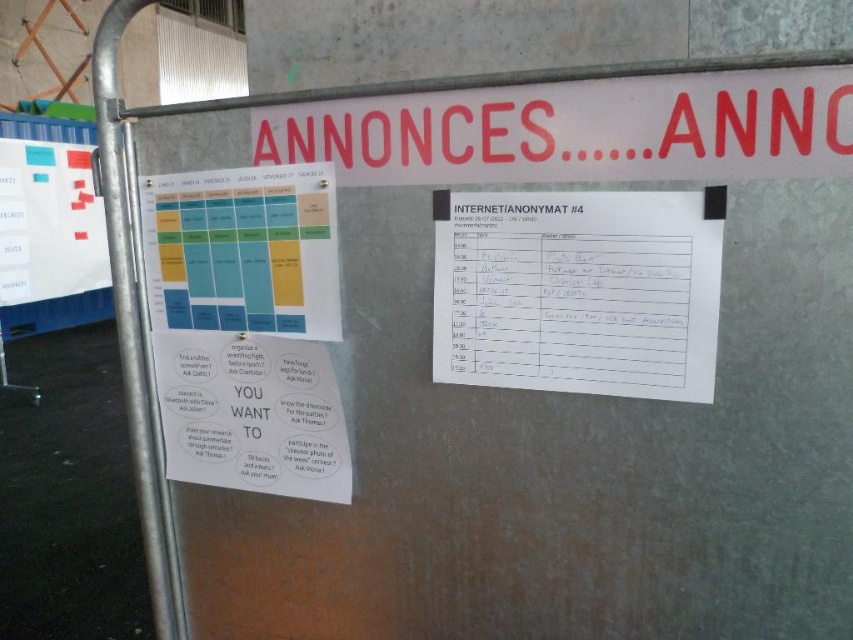
Question: Which point is farther from the camera taking this photo?

Choices:
 (A) (602, 225)
 (B) (265, 264)

Answer: (B)

Question: Which is nearer to the matte paper poster at center?

Choices:
 (A) matte plastic calendar at center
 (B) white paper at upper right
 (C) white paper sign at upper center
 (D) white paper with colorful stickers at left

Answer: (A)

Question: Does white paper at upper right appear on the right side of matte plastic calendar at center?

Choices:
 (A) no
 (B) yes

Answer: (B)

Question: Does white paper sign at upper center have a smaller size compared to white paper with colorful stickers at left?

Choices:
 (A) yes
 (B) no

Answer: (A)

Question: Which point appears closest to the camera in this image?

Choices:
 (A) (225, 260)
 (B) (706, 240)
 (C) (837, 173)

Answer: (C)

Question: Where is white paper sign at upper center located in relation to white paper with colorful stickers at left in the image?

Choices:
 (A) above
 (B) below

Answer: (B)